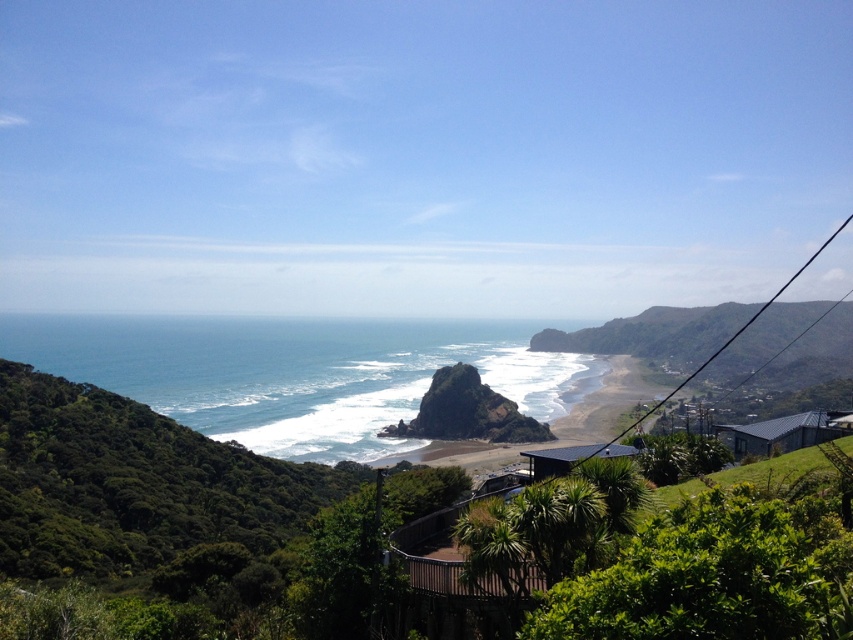
Question: Estimate the real-world distances between objects in this image. Which object is closer to the gray corrugated metal hut at lower right?

Choices:
 (A) green corrugated metal hut at center
 (B) blue ocean water at center

Answer: (A)

Question: Based on their relative distances, which object is nearer to the green corrugated metal hut at center?

Choices:
 (A) gray corrugated metal hut at lower right
 (B) blue ocean water at center

Answer: (A)

Question: Observing the image, what is the correct spatial positioning of blue ocean water at center in reference to green corrugated metal hut at center?

Choices:
 (A) below
 (B) above

Answer: (B)

Question: Does gray corrugated metal hut at lower right have a greater width compared to green corrugated metal hut at center?

Choices:
 (A) yes
 (B) no

Answer: (A)

Question: Which object appears farthest from the camera in this image?

Choices:
 (A) blue ocean water at center
 (B) gray corrugated metal hut at lower right

Answer: (A)

Question: Does blue ocean water at center have a lesser width compared to green corrugated metal hut at center?

Choices:
 (A) yes
 (B) no

Answer: (B)